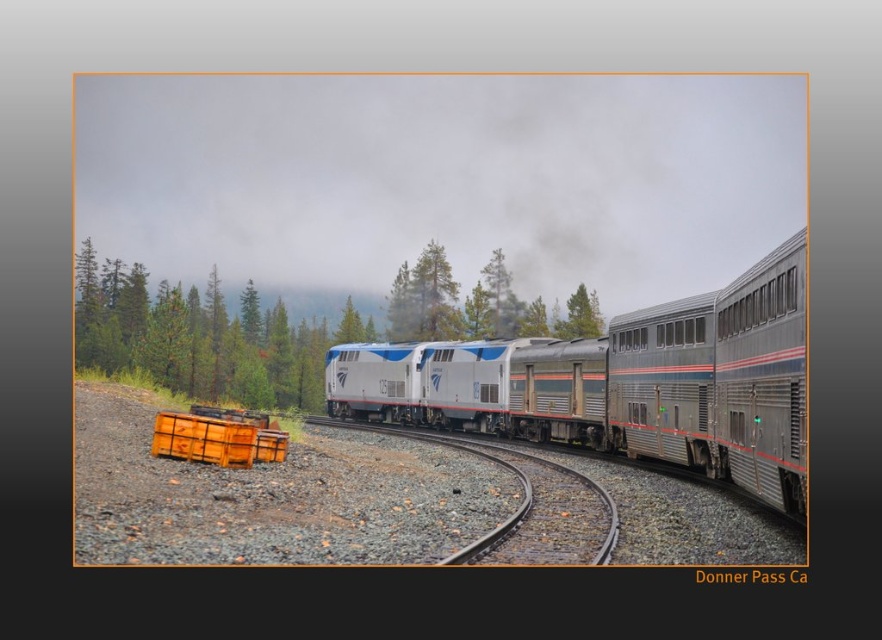
You are a photographer standing near the orange crates in the foreground. You want to take a photo of the silver metallic train at center and the green leafy tree at center. Which object will appear taller in the photo?

The green leafy tree at center will appear taller in the photo because it is taller than the silver metallic train at center according to the description.

You are standing at point A, which is located at coordinates [623,381]. You want to take a photo of the silver metallic train at center. Is the train directly in front of you?

Yes, the silver metallic train at center is directly in front of you at point A because the coordinates [623,381] indicate that the train is located precisely at that position.